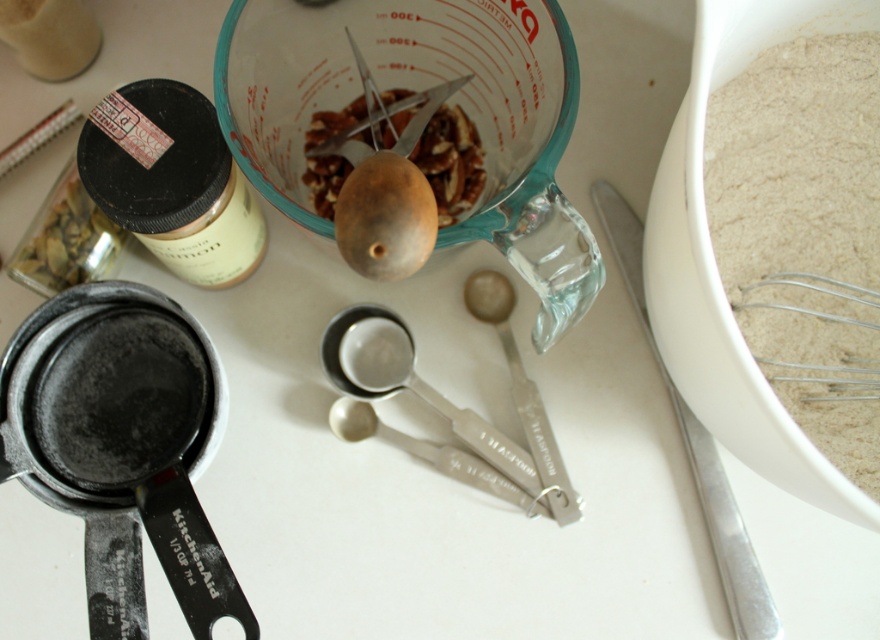
You are a baker preparing dough and need to know which item is shorter between the white powdery flour at right and the silver metallic knife at lower right. Which one should you choose?

The white powdery flour at right is not as tall as the silver metallic knife at lower right, so the white powdery flour at right is shorter and should be chosen.